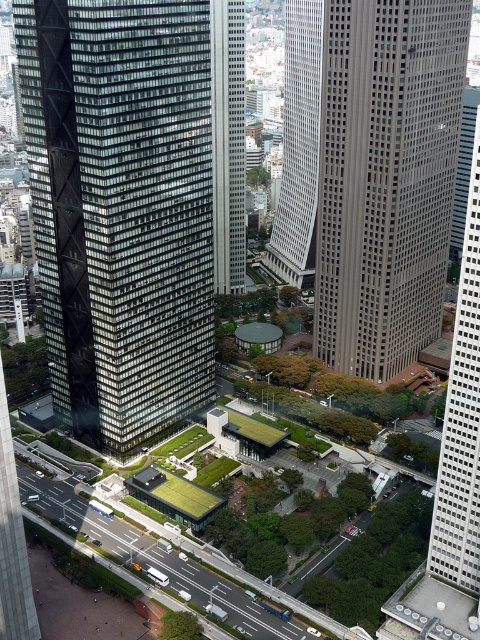
Question: Which point is farther from the camera taking this photo?

Choices:
 (A) (136, 324)
 (B) (463, 381)

Answer: (A)

Question: Is gray concrete skyscraper at center positioned behind smooth glass skyscraper at right?

Choices:
 (A) yes
 (B) no

Answer: (A)

Question: Can you confirm if black glass skyscraper at center is positioned to the right of gray concrete skyscraper at center?

Choices:
 (A) yes
 (B) no

Answer: (B)

Question: Which of the following is the closest to the observer?

Choices:
 (A) gray concrete skyscraper at center
 (B) smooth glass skyscraper at center
 (C) black glass skyscraper at center
 (D) smooth glass skyscraper at right

Answer: (D)

Question: Can you confirm if black glass skyscraper at center is smaller than smooth glass skyscraper at right?

Choices:
 (A) yes
 (B) no

Answer: (A)

Question: Estimate the real-world distances between objects in this image. Which object is closer to the smooth glass skyscraper at center?

Choices:
 (A) black glass skyscraper at center
 (B) gray concrete skyscraper at center

Answer: (B)